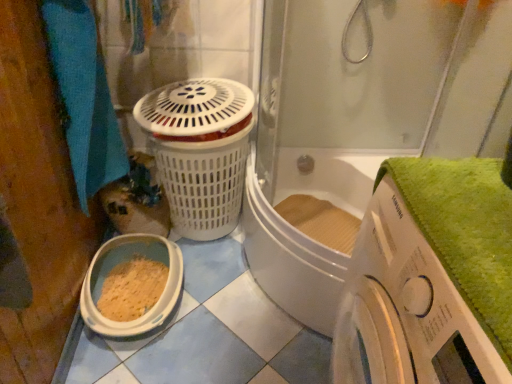
Measure the distance between white plastic washing machine at lower right and camera.

white plastic washing machine at lower right and camera are 19.34 inches apart.

The width and height of the screenshot is (512, 384). I want to click on blue fabric towel at left, so click(84, 97).

You are a GUI agent. You are given a task and a screenshot of the screen. Output one action in this format:
    pyautogui.click(x=<x>, y=<y>)
    Task: Click on the white plastic washing machine at lower right
    The image size is (512, 384).
    Given the screenshot: What is the action you would take?
    coord(406,309)

This screenshot has width=512, height=384. What are the coordinates of `washing machine below the transparent glass shower door at upper center (from a real-world perspective)` in the screenshot? It's located at (406, 309).

Is transparent glass shower door at upper center inside the boundaries of white plastic washing machine at lower right, or outside?

transparent glass shower door at upper center cannot be found inside white plastic washing machine at lower right.

From a real-world perspective, who is located higher, transparent glass shower door at upper center or white plastic washing machine at lower right?

transparent glass shower door at upper center, from a real-world perspective.

Considering the relative positions of white plastic washing machine at lower right and transparent glass shower door at upper center in the image provided, is white plastic washing machine at lower right to the left or to the right of transparent glass shower door at upper center?

Based on their positions, white plastic washing machine at lower right is located to the right of transparent glass shower door at upper center.

Is white plastic washing machine at lower right positioned with its back to transparent glass shower door at upper center?

white plastic washing machine at lower right is not turned away from transparent glass shower door at upper center.

Locate an element on the screen. The width and height of the screenshot is (512, 384). washing machine that is on the right side of transparent glass shower door at upper center is located at coordinates (406, 309).

Is white plastic washing machine at lower right in front of or behind transparent glass shower door at upper center in the image?

In the image, white plastic washing machine at lower right appears in front of transparent glass shower door at upper center.

Between point (401, 352) and point (99, 94), which one is positioned behind?

The point (99, 94) is behind.

From the image's perspective, which is above, white plastic washing machine at lower right or blue fabric towel at left?

blue fabric towel at left.

Is white plastic washing machine at lower right looking in the opposite direction of blue fabric towel at left?

No, white plastic washing machine at lower right is not facing the opposite direction of blue fabric towel at left.

Are blue fabric towel at left and transparent glass shower door at upper center beside each other?

There is a gap between blue fabric towel at left and transparent glass shower door at upper center.

Is blue fabric towel at left to the left of transparent glass shower door at upper center from the viewer's perspective?

Indeed, blue fabric towel at left is positioned on the left side of transparent glass shower door at upper center.

Consider the image. Considering the relative sizes of blue fabric towel at left and transparent glass shower door at upper center in the image provided, is blue fabric towel at left wider than transparent glass shower door at upper center?

No, blue fabric towel at left is not wider than transparent glass shower door at upper center.

Looking at this image, can you tell me how much blue fabric towel at left and transparent glass shower door at upper center differ in facing direction?

90 degrees separate the facing orientations of blue fabric towel at left and transparent glass shower door at upper center.

Does blue fabric towel at left touch white plastic washing machine at lower right?

No, blue fabric towel at left is not in contact with white plastic washing machine at lower right.

Between blue fabric towel at left and white plastic washing machine at lower right, which one has larger size?

Bigger between the two is white plastic washing machine at lower right.

From a real-world perspective, is blue fabric towel at left below white plastic washing machine at lower right?

Actually, blue fabric towel at left is physically above white plastic washing machine at lower right in the real world.

You are a GUI agent. You are given a task and a screenshot of the screen. Output one action in this format:
    pyautogui.click(x=<x>, y=<y>)
    Task: Click on the bath towel above the transparent glass shower door at upper center (from a real-world perspective)
    The image size is (512, 384).
    Given the screenshot: What is the action you would take?
    pyautogui.click(x=84, y=97)

From the image's perspective, between transparent glass shower door at upper center and blue fabric towel at left, who is located below?

transparent glass shower door at upper center, from the image's perspective.

Between transparent glass shower door at upper center and blue fabric towel at left, which one appears on the left side from the viewer's perspective?

blue fabric towel at left is more to the left.

The image size is (512, 384). What are the coordinates of `shower door above the white plastic washing machine at lower right (from the image's perspective)` in the screenshot? It's located at (358, 125).

You are a GUI agent. You are given a task and a screenshot of the screen. Output one action in this format:
    pyautogui.click(x=<x>, y=<y>)
    Task: Click on the washing machine located on the right of transparent glass shower door at upper center
    
    Given the screenshot: What is the action you would take?
    pyautogui.click(x=406, y=309)

Based on their spatial positions, is white plastic washing machine at lower right or transparent glass shower door at upper center further from blue fabric towel at left?

The object further to blue fabric towel at left is white plastic washing machine at lower right.

From the image, which object appears to be farther from transparent glass shower door at upper center, white plastic washing machine at lower right or blue fabric towel at left?

Among the two, blue fabric towel at left is located further to transparent glass shower door at upper center.

Which object lies further to the anchor point white plastic washing machine at lower right, blue fabric towel at left or transparent glass shower door at upper center?

Based on the image, blue fabric towel at left appears to be further to white plastic washing machine at lower right.

Considering their positions, is blue fabric towel at left positioned further to transparent glass shower door at upper center than white plastic washing machine at lower right?

The object further to transparent glass shower door at upper center is blue fabric towel at left.

Based on their spatial positions, is transparent glass shower door at upper center or blue fabric towel at left closer to white plastic washing machine at lower right?

transparent glass shower door at upper center is positioned closer to the anchor white plastic washing machine at lower right.

From the image, which object appears to be nearer to blue fabric towel at left, transparent glass shower door at upper center or white plastic washing machine at lower right?

transparent glass shower door at upper center is positioned closer to the anchor blue fabric towel at left.

Identify the location of shower door between blue fabric towel at left and white plastic washing machine at lower right. The height and width of the screenshot is (384, 512). (358, 125).